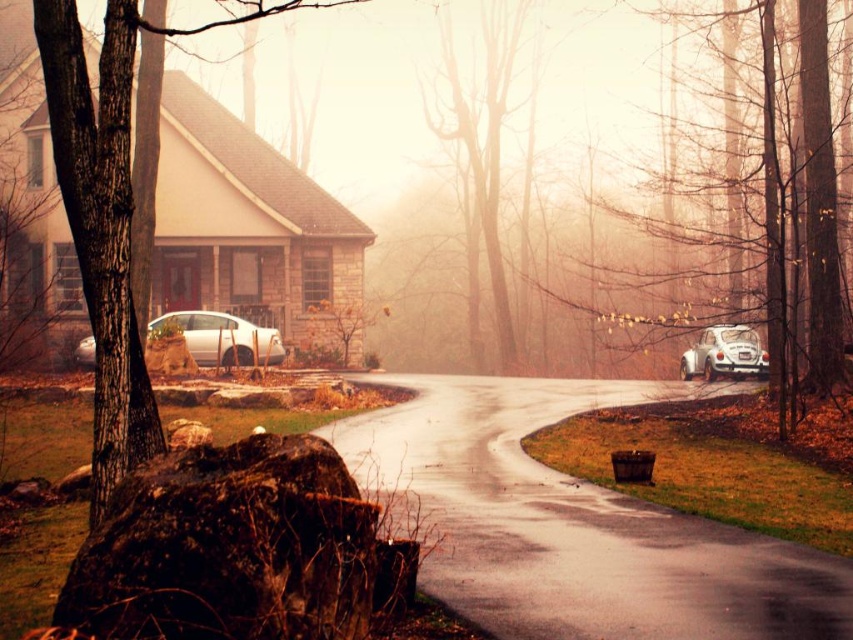
Question: Among these points, which one is farthest from the camera?

Choices:
 (A) (103, 244)
 (B) (738, 349)
 (C) (386, 458)

Answer: (B)

Question: Among these objects, which one is nearest to the camera?

Choices:
 (A) white matte car at right
 (B) bare wood tree at center
 (C) smooth bark tree at right

Answer: (C)

Question: Can you confirm if brown rough tree at left is thinner than satin white sedan at center?

Choices:
 (A) no
 (B) yes

Answer: (A)

Question: Can you confirm if brown rough tree at left is bigger than bare wood tree at center?

Choices:
 (A) no
 (B) yes

Answer: (A)

Question: Does smooth asphalt driveway at center come behind satin white sedan at center?

Choices:
 (A) no
 (B) yes

Answer: (A)

Question: Which object is positioned farthest from the white matte car at right?

Choices:
 (A) satin white sedan at center
 (B) bare wood tree at center
 (C) smooth asphalt driveway at center
 (D) brown rough bark tree at left

Answer: (B)